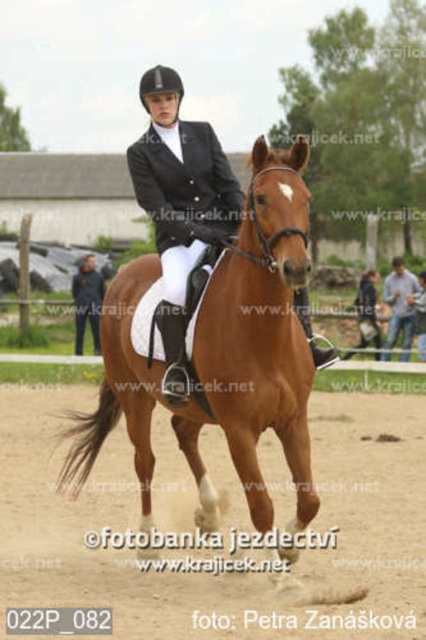
You are a drone operator tasked with capturing aerial footage of the horse riding event. The drone is currently hovering above the brown sand at center. To ensure safety, you need to move the drone to a position where it won not interfere with the rider and the horse. Which direction should you move the drone to avoid the rider and horse?

The brown sand at center is located at point (x=227, y=572). To avoid the rider and horse, move the drone away from this coordinate towards an area not occupied by the rider and horse, such as the edges or corners of the arena.

You are a photographer positioned at the edge of the arena. You need to capture a photo of the rider and horse. Since the black leather jacket at center is taller than the brown sand at center, will the rider be visible above the sand when taking the photo from your current position?

Yes, the rider will be visible above the sand because the black leather jacket at center is taller than the brown sand at center.